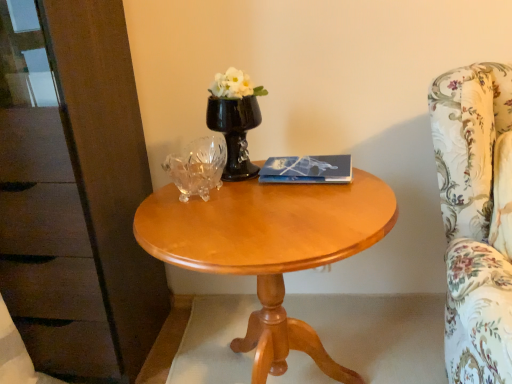
Question: From the image's perspective, is glossy wood table at center located above or below blue glossy book at center?

Choices:
 (A) below
 (B) above

Answer: (A)

Question: Choose the correct answer: Is glossy wood table at center inside blue glossy book at center or outside it?

Choices:
 (A) inside
 (B) outside

Answer: (B)

Question: Estimate the real-world distances between objects in this image. Which object is farther from the floral fabric armchair at right?

Choices:
 (A) matte brown dresser at left
 (B) black glass vase at center
 (C) blue glossy book at center
 (D) glossy wood table at center

Answer: (A)

Question: Which object is positioned farthest from the matte brown dresser at left?

Choices:
 (A) black glass vase at center
 (B) floral fabric armchair at right
 (C) glossy wood table at center
 (D) blue glossy book at center

Answer: (B)